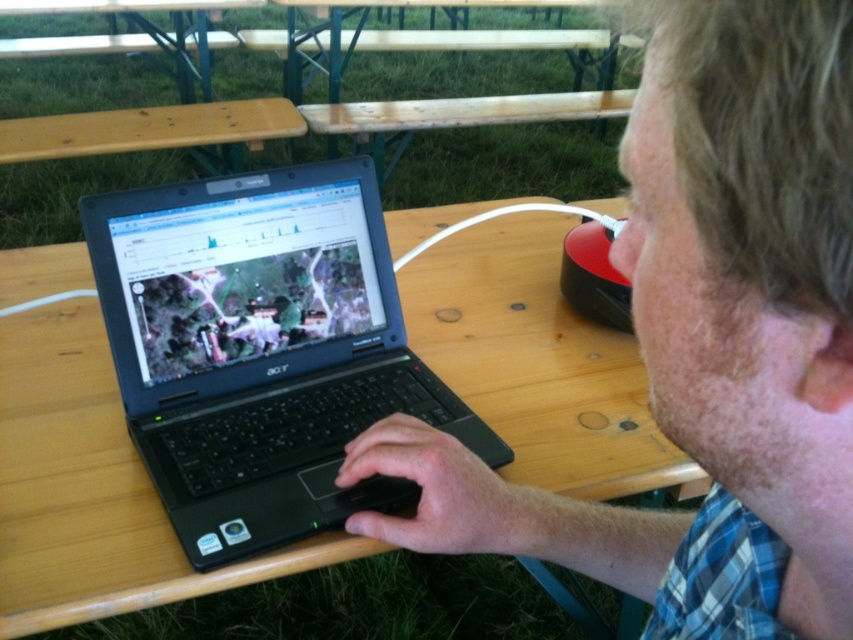
Can you confirm if plaid shirt at center is thinner than black matte laptop at center?

Yes.

Which of these two, plaid shirt at center or black matte laptop at center, stands shorter?

With less height is plaid shirt at center.

The width and height of the screenshot is (853, 640). What are the coordinates of `plaid shirt at center` in the screenshot? It's located at (705, 340).